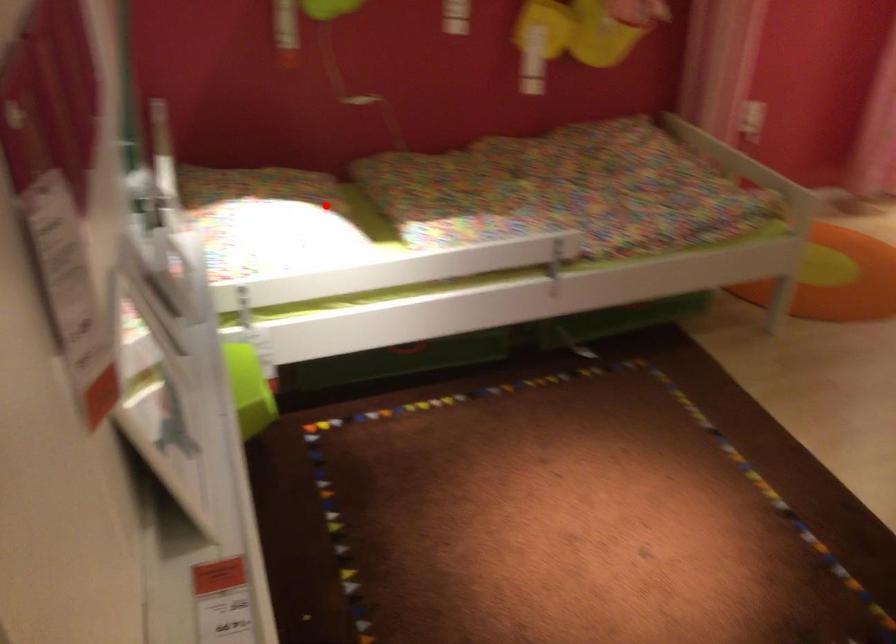
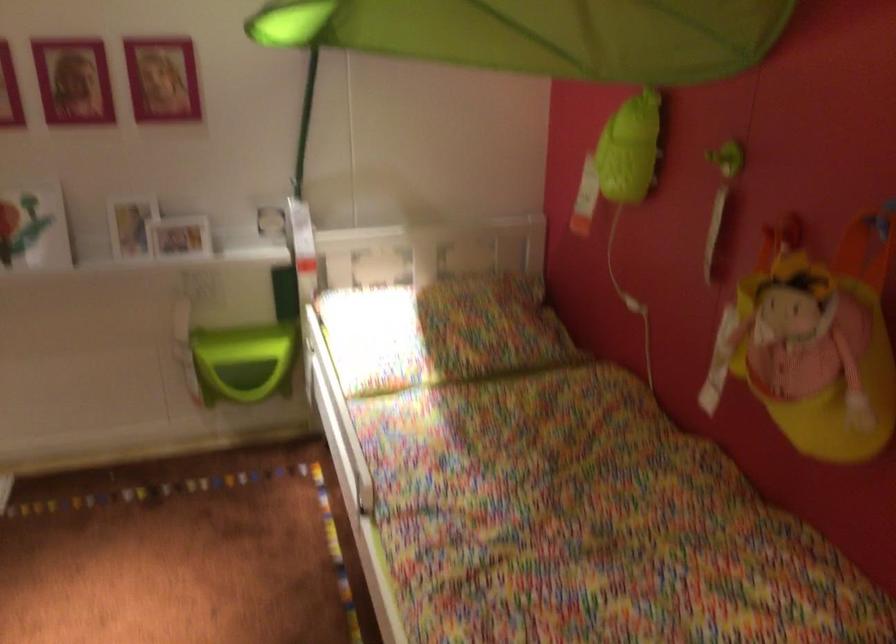
Question: I am providing you with two images of the same scene from different viewpoints. A red point is marked on the first image. At the location where the point appears in image 1, is it still visible in image 2?

Choices:
 (A) Yes
 (B) No

Answer: (A)